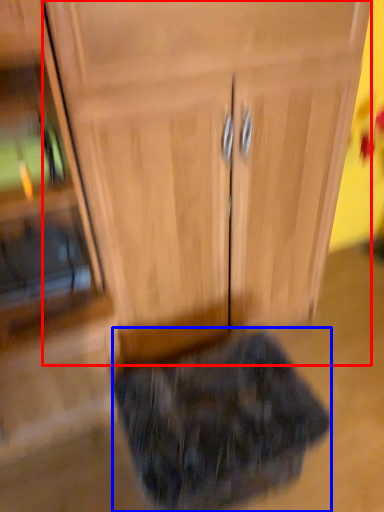
Question: Which point is further to the camera, cabinetry (highlighted by a red box) or animal (highlighted by a blue box)?

Choices:
 (A) cabinetry
 (B) animal

Answer: (B)